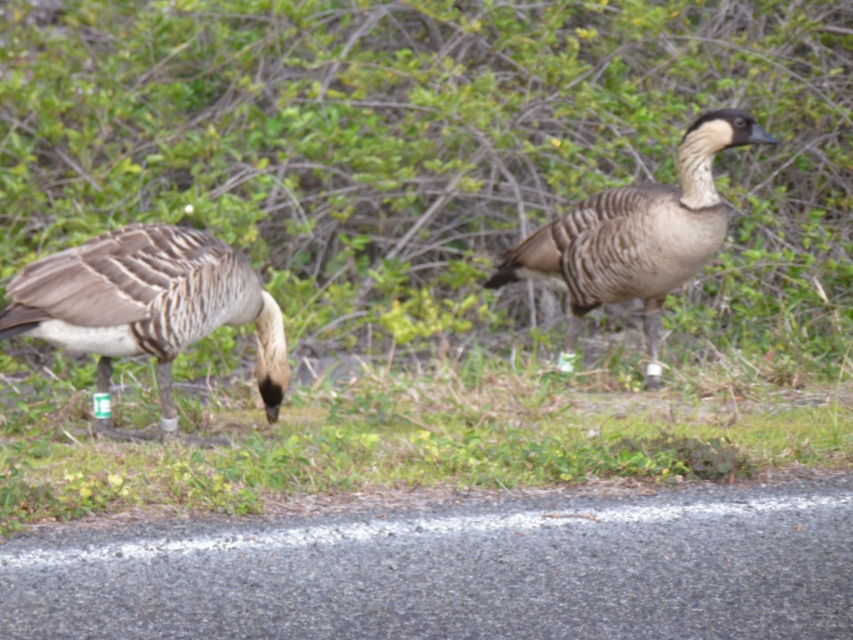
Based on the photo, you are a photographer aiming to capture both the green grass at lower center and the brown speckled goose at center in a single frame. Based on their positions, which object is wider and might require adjusting your camera angle to ensure both fit in the frame?

The green grass at lower center might be wider than the brown speckled goose at center, so you should adjust your camera angle to accommodate its width to include both in the frame.

You are a wildlife photographer standing at the edge of the road where the geese are. You want to take a photo of the brown feathered goose at left without disturbing them. If your camera has a focal length that allows clear photos up to 15 feet, will you need to move closer?

The brown feathered goose at left is 17.20 feet away from the camera. Since your camera can only capture clearly up to 15 feet, you need to move closer to ensure a clear photo.